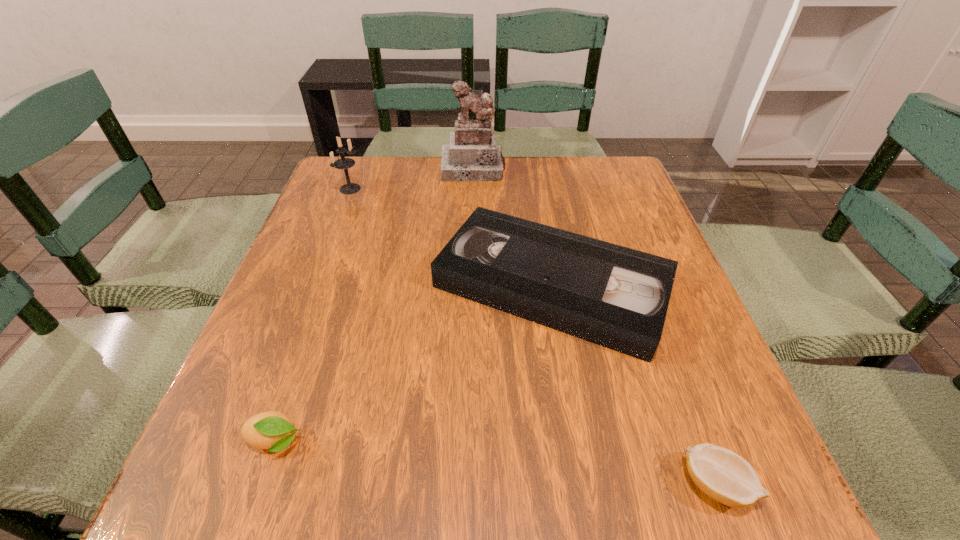
Identify the location of figurine. The height and width of the screenshot is (540, 960). (472, 155).

Locate an element on the screen. The image size is (960, 540). the second tallest object is located at coordinates (344, 163).

The height and width of the screenshot is (540, 960). In order to click on videotape in this screenshot , I will do `click(617, 297)`.

Where is `the left lemon`? the left lemon is located at coordinates (271, 430).

Locate an element on the screen. The image size is (960, 540). the shorter lemon is located at coordinates (724, 476).

The image size is (960, 540). Identify the location of the shortest object. (724, 476).

Find the location of a particular element. The height and width of the screenshot is (540, 960). vacant space located 0.350m on the front-facing side of the tallest object is located at coordinates (471, 268).

The image size is (960, 540). I want to click on vacant space located on the right of the second tallest object, so click(x=401, y=189).

This screenshot has height=540, width=960. I want to click on free space located on the back of the videotape, so click(537, 198).

Image resolution: width=960 pixels, height=540 pixels. I want to click on free region located with leaves positioned above the taller lemon, so click(x=441, y=441).